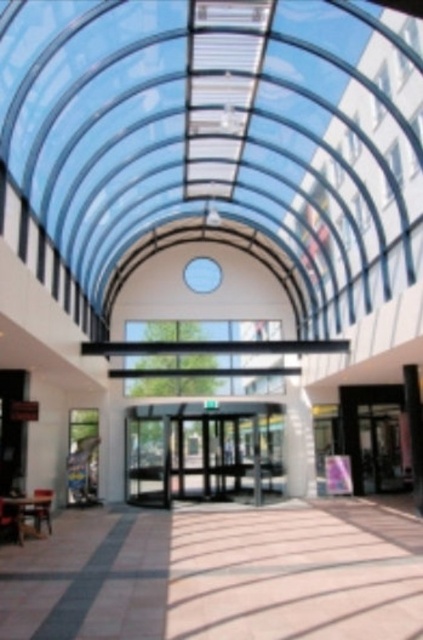
Is the position of transparent glass doors at center less distant than that of glass door at center?

No.

Who is more forward, [255,428] or [351,432]?

Point [255,428] is in front.

Between point (214, 480) and point (351, 449), which one is positioned in front?

Positioned in front is point (351, 449).

The width and height of the screenshot is (423, 640). Find the location of `transparent glass doors at center`. transparent glass doors at center is located at coordinates (200, 452).

Can you confirm if glass door at center is positioned below smooth white pillar at right?

Yes, glass door at center is below smooth white pillar at right.

Image resolution: width=423 pixels, height=640 pixels. I want to click on glass door at center, so coord(357,419).

Is point (376, 401) positioned before point (417, 371)?

No.

I want to click on glass door at center, so click(x=357, y=419).

Who is more distant from viewer, (159, 481) or (420, 480)?

Positioned behind is point (159, 481).

From the picture: Between transparent glass doors at center and smooth white pillar at right, which one has less height?

transparent glass doors at center

Is point (280, 452) positioned after point (412, 451)?

Yes.

I want to click on transparent glass doors at center, so click(200, 452).